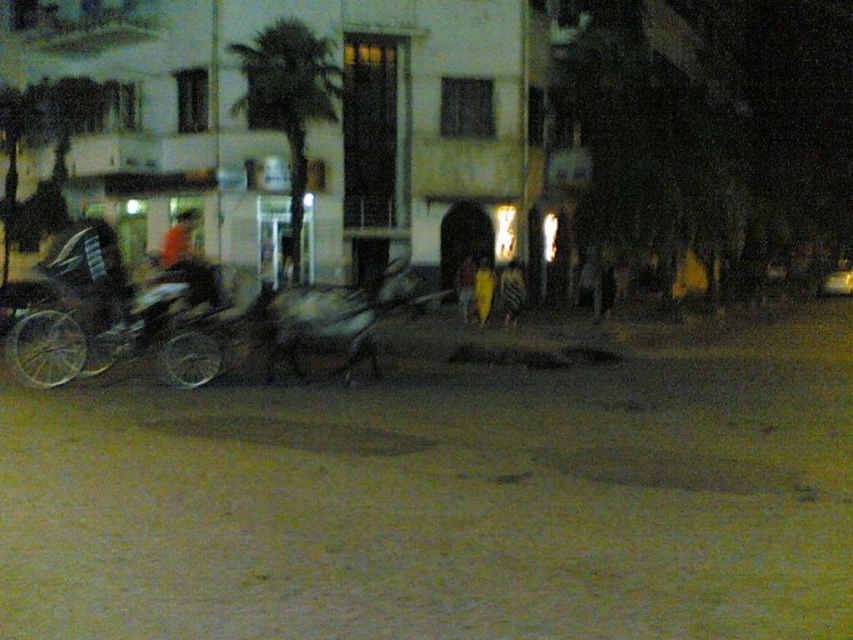
Question: Which object is farther from the camera taking this photo?

Choices:
 (A) dark fabric shirt at center
 (B) green leafy palm tree at center

Answer: (B)

Question: Does green leafy palm tree at center appear on the right side of dark fabric shirt at center?

Choices:
 (A) no
 (B) yes

Answer: (B)

Question: Does green leafy palm tree at center have a smaller size compared to dark fabric shirt at center?

Choices:
 (A) no
 (B) yes

Answer: (B)

Question: Among these points, which one is farthest from the camera?

Choices:
 (A) (294, 224)
 (B) (165, 260)

Answer: (A)

Question: Is green leafy palm tree at center to the right of dark fabric shirt at center from the viewer's perspective?

Choices:
 (A) no
 (B) yes

Answer: (B)